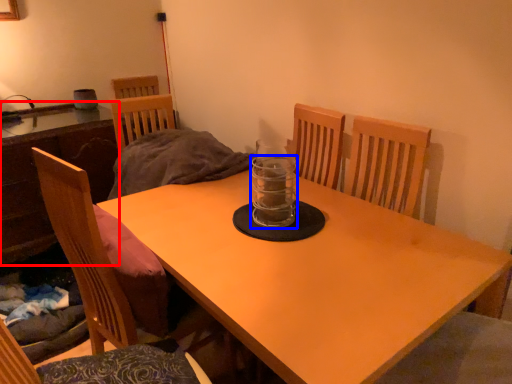
Question: Which of the following is the farthest to the observer, table (highlighted by a red box) or glass jar (highlighted by a blue box)?

Choices:
 (A) table
 (B) glass jar

Answer: (A)